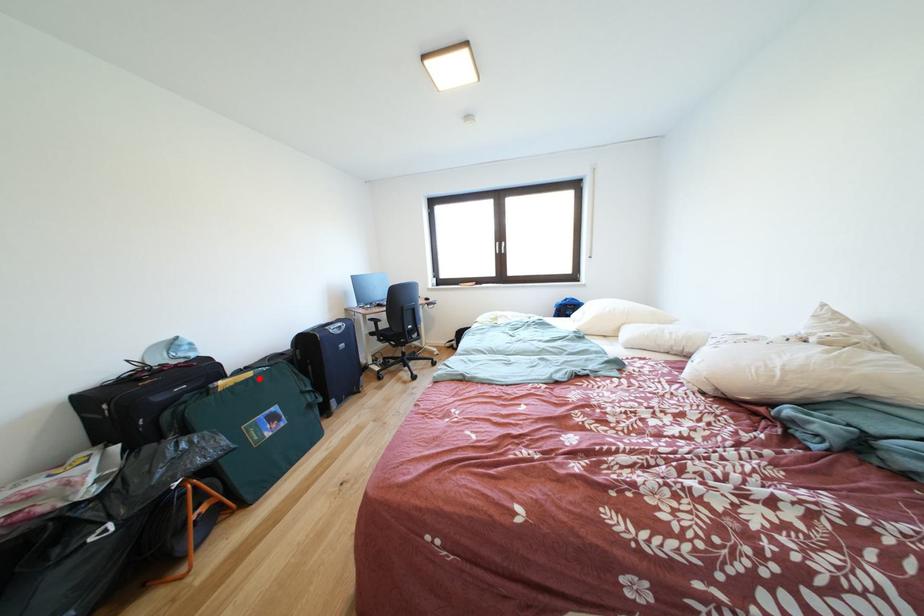
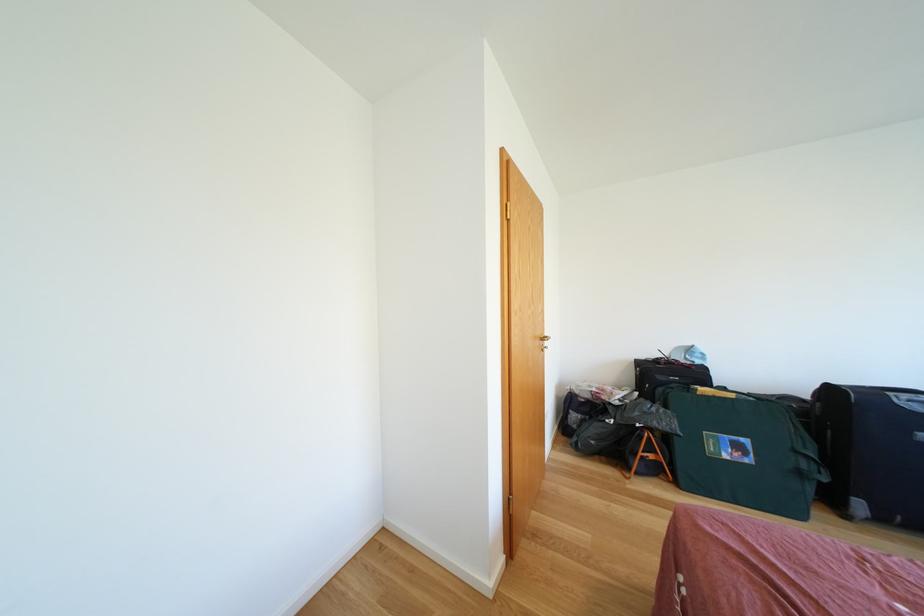
Find the pixel in the second image that matches the highlighted location in the first image.

(739, 400)